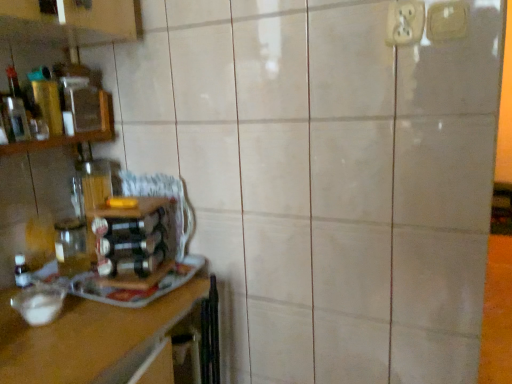
Question: Does translucent glass bottle at left have a greater height compared to white plastic electric outlet at upper right, the 1th electric outlet from the right?

Choices:
 (A) yes
 (B) no

Answer: (A)

Question: Is translucent glass bottle at left shorter than white plastic electric outlet at upper right, the 2th electric outlet from the left?

Choices:
 (A) no
 (B) yes

Answer: (A)

Question: Is translucent glass bottle at left positioned behind white plastic electric outlet at upper right, the 2th electric outlet from the left?

Choices:
 (A) no
 (B) yes

Answer: (B)

Question: Does translucent glass bottle at left have a greater width compared to white plastic electric outlet at upper right, the 1th electric outlet from the right?

Choices:
 (A) yes
 (B) no

Answer: (A)

Question: From the image's perspective, is translucent glass bottle at left on top of white plastic electric outlet at upper right, the 1th electric outlet from the right?

Choices:
 (A) yes
 (B) no

Answer: (B)

Question: Is point (452, 31) closer or farther from the camera than point (86, 324)?

Choices:
 (A) closer
 (B) farther

Answer: (A)

Question: In the image, is white plastic electric outlet at upper right, the 1th electric outlet from the right, positioned in front of or behind wooden at left?

Choices:
 (A) front
 (B) behind

Answer: (B)

Question: From a real-world perspective, is white plastic electric outlet at upper right, the 2th electric outlet from the left, positioned above or below wooden at left?

Choices:
 (A) above
 (B) below

Answer: (A)

Question: Visually, is white plastic electric outlet at upper right, the 1th electric outlet from the right, positioned to the left or to the right of wooden at left?

Choices:
 (A) right
 (B) left

Answer: (A)

Question: From a real-world perspective, is translucent glass bottle at left positioned above or below white plastic electric outlet at upper right, the 1th electric outlet from the right?

Choices:
 (A) below
 (B) above

Answer: (A)

Question: Considering the relative positions of translucent glass bottle at left and white plastic electric outlet at upper right, the 2th electric outlet from the left, in the image provided, is translucent glass bottle at left to the left or to the right of white plastic electric outlet at upper right, the 2th electric outlet from the left,?

Choices:
 (A) right
 (B) left

Answer: (B)

Question: Considering the positions of point (140, 218) and point (456, 29), is point (140, 218) closer or farther from the camera than point (456, 29)?

Choices:
 (A) farther
 (B) closer

Answer: (A)

Question: Choose the correct answer: Is translucent glass bottle at left inside white plastic electric outlet at upper right, the 1th electric outlet from the right, or outside it?

Choices:
 (A) inside
 (B) outside

Answer: (B)

Question: Considering the positions of translucent glass bottle at left and wooden at left in the image, is translucent glass bottle at left wider or thinner than wooden at left?

Choices:
 (A) wide
 (B) thin

Answer: (B)

Question: Is translucent glass bottle at left inside or outside of wooden at left?

Choices:
 (A) outside
 (B) inside

Answer: (A)